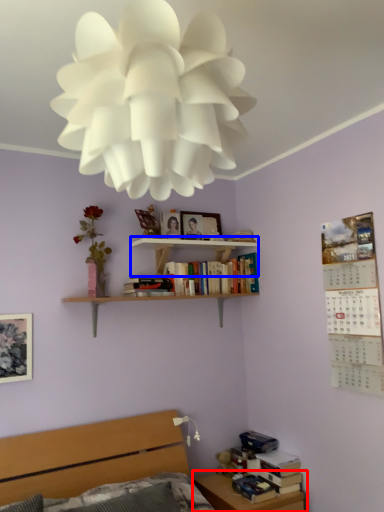
Question: Which of the following is the closest to the observer, table (highlighted by a red box) or shelf (highlighted by a blue box)?

Choices:
 (A) table
 (B) shelf

Answer: (A)